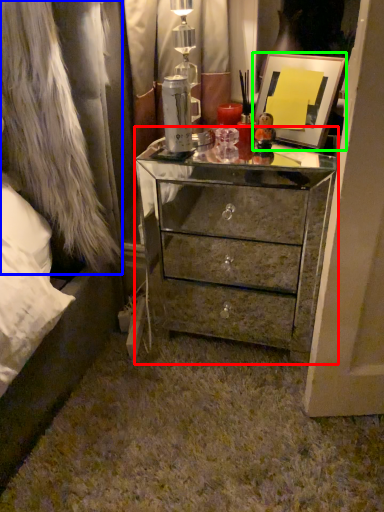
Question: Which object is the farthest from chest of drawers (highlighted by a red box)? Choose among these: fur coat (highlighted by a blue box) or picture frame (highlighted by a green box).

Choices:
 (A) fur coat
 (B) picture frame

Answer: (A)